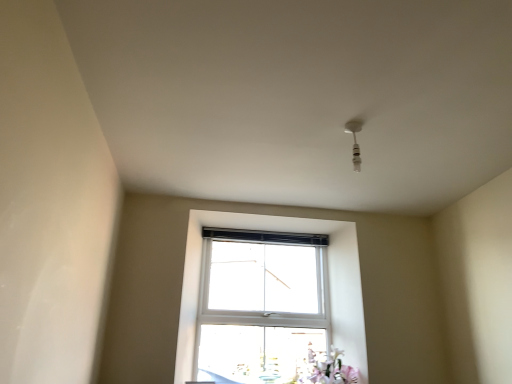
Question: Should I look upward or downward to see white plastic light fixture at upper center?

Choices:
 (A) down
 (B) up

Answer: (B)

Question: Is the position of white plastic light fixture at upper center more distant than that of pink matte flower at lower right?

Choices:
 (A) yes
 (B) no

Answer: (B)

Question: Does white plastic light fixture at upper center have a greater height compared to pink matte flower at lower right?

Choices:
 (A) no
 (B) yes

Answer: (A)

Question: Would you say white plastic light fixture at upper center is outside pink matte flower at lower right?

Choices:
 (A) no
 (B) yes

Answer: (B)

Question: Considering the relative positions of white plastic light fixture at upper center and pink matte flower at lower right in the image provided, is white plastic light fixture at upper center to the left of pink matte flower at lower right from the viewer's perspective?

Choices:
 (A) no
 (B) yes

Answer: (A)

Question: Can you confirm if white plastic light fixture at upper center is positioned to the right of pink matte flower at lower right?

Choices:
 (A) yes
 (B) no

Answer: (A)

Question: From the image's perspective, does white plastic light fixture at upper center appear lower than pink matte flower at lower right?

Choices:
 (A) yes
 (B) no

Answer: (B)

Question: Is the depth of pink matte flower at lower right greater than that of white plastic light fixture at upper center?

Choices:
 (A) yes
 (B) no

Answer: (A)

Question: Can you confirm if pink matte flower at lower right is smaller than white plastic light fixture at upper center?

Choices:
 (A) no
 (B) yes

Answer: (A)

Question: From the image's perspective, is pink matte flower at lower right located above white plastic light fixture at upper center?

Choices:
 (A) no
 (B) yes

Answer: (A)

Question: Can you confirm if pink matte flower at lower right is positioned to the left of white plastic light fixture at upper center?

Choices:
 (A) no
 (B) yes

Answer: (B)

Question: Is the position of pink matte flower at lower right less distant than that of white plastic light fixture at upper center?

Choices:
 (A) yes
 (B) no

Answer: (B)

Question: From the image's perspective, is pink matte flower at lower right below white plastic light fixture at upper center?

Choices:
 (A) yes
 (B) no

Answer: (A)

Question: Considering the positions of pink matte flower at lower right and white plastic light fixture at upper center in the image, is pink matte flower at lower right bigger or smaller than white plastic light fixture at upper center?

Choices:
 (A) small
 (B) big

Answer: (B)